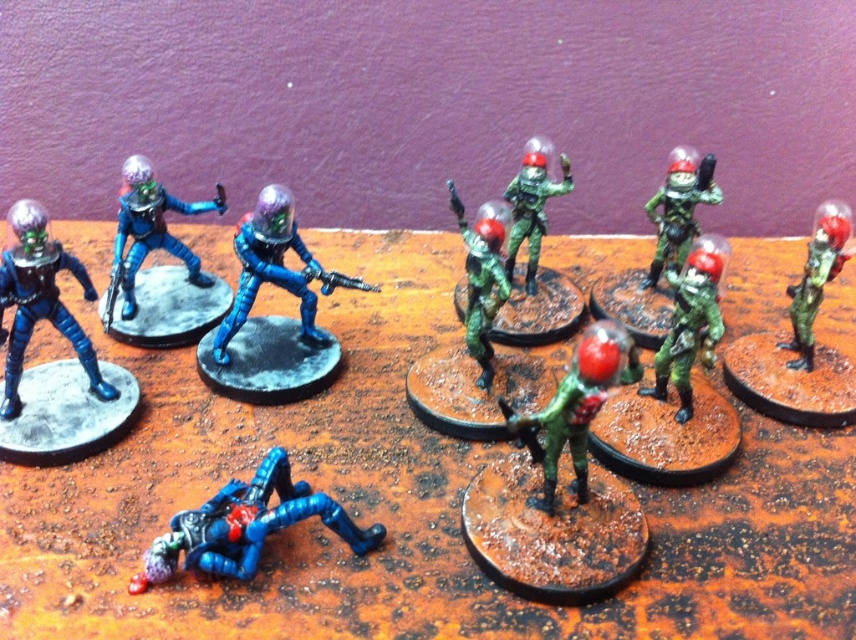
You are a collector who wants to place a new figurine between the brushed metal figure at lower left and the green matte figure at center right. Based on their positions, which of the two existing figurines is closer to you, and where should you position the new figurine to maintain symmetry?

The brushed metal figure at lower left is closer to the viewer than the green matte figure at center right. To maintain symmetry, place the new figurine equidistant between both, closer to the viewer side of the green matte figure at center right.

In the scene shown: You are a photographer standing at the camera position. You want to capture a closeup shot of the brushed metal figure at lower left. Can you estimate how far you need to move forward to focus on it?

The brushed metal figure at lower left is 1.05 meters away from the camera, so you need to move forward 1.05 meters to focus on it.

You are a collector who wants to display these figurines on a shelf. You have a limited height of 12 inches for the display. If the green matte figure at center right is 14 inches tall, will the brushed metal figure at lower left fit under the height restriction?

The brushed metal figure at lower left is not as tall as the green matte figure at center right, which is 14 inches tall. Since the brushed metal figure is shorter, it would fit under the 12 inch height restriction if it is under 12 inches. However, since the green figure is already taller than the limit, both would exceed the height restriction. Therefore, neither can be displayed on the shelf.